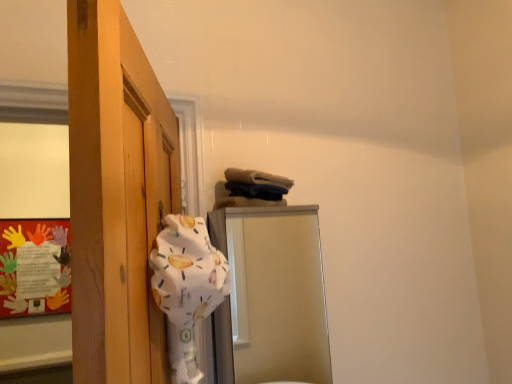
Question: From the image's perspective, is white fabric at left above or below metallic silver mirror at center?

Choices:
 (A) above
 (B) below

Answer: (A)

Question: Considering the relative positions of white fabric at left and metallic silver mirror at center in the image provided, is white fabric at left to the left or to the right of metallic silver mirror at center?

Choices:
 (A) left
 (B) right

Answer: (A)

Question: Estimate the real-world distances between objects in this image. Which object is closer to the metallic silver mirror at center?

Choices:
 (A) multicolored paper at left
 (B) white fabric at left

Answer: (A)

Question: Which object is the closest to the multicolored paper at left?

Choices:
 (A) metallic silver mirror at center
 (B) white fabric at left

Answer: (A)